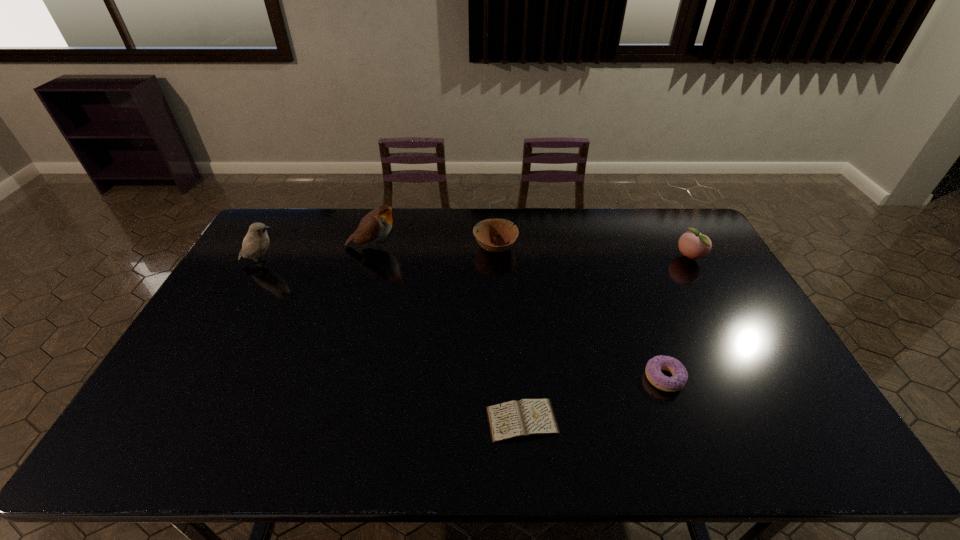
What are the coordinates of `free spot that satisfies the following two spatial constraints: 1. on the front side of the third shortest object; 2. on the right side of the second nearest object` in the screenshot? It's located at (501, 378).

This screenshot has width=960, height=540. In order to click on free region that satisfies the following two spatial constraints: 1. on the back side of the rightmost object; 2. at the face of the right bird in this screenshot , I will do `click(683, 246)`.

The width and height of the screenshot is (960, 540). I want to click on vacant area that satisfies the following two spatial constraints: 1. at the face of the right bird; 2. on the right side of the fourth tallest object, so click(373, 247).

In order to click on vacant space that satisfies the following two spatial constraints: 1. at the beak of the leftmost object; 2. on the left side of the fifth farthest object in this screenshot , I will do `click(198, 378)`.

Identify the location of vacant space that satisfies the following two spatial constraints: 1. at the beak of the second nearest object; 2. on the right side of the leftmost object. (198, 378).

Locate an element on the screen. vacant region that satisfies the following two spatial constraints: 1. on the back side of the doughnut; 2. at the face of the farther bird is located at coordinates (615, 246).

Find the location of a particular element. The width and height of the screenshot is (960, 540). free point that satisfies the following two spatial constraints: 1. at the face of the right bird; 2. on the back side of the second object from right to left is located at coordinates (336, 378).